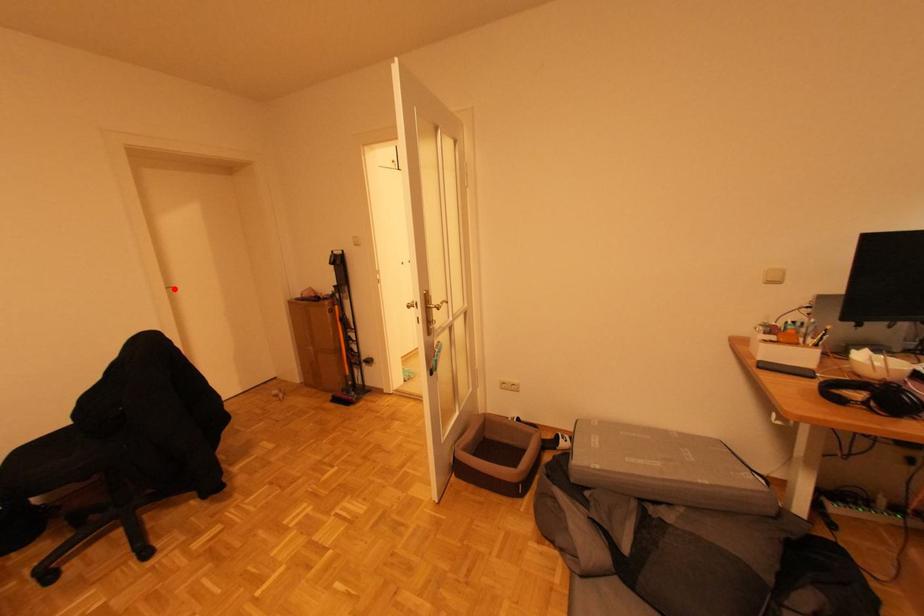
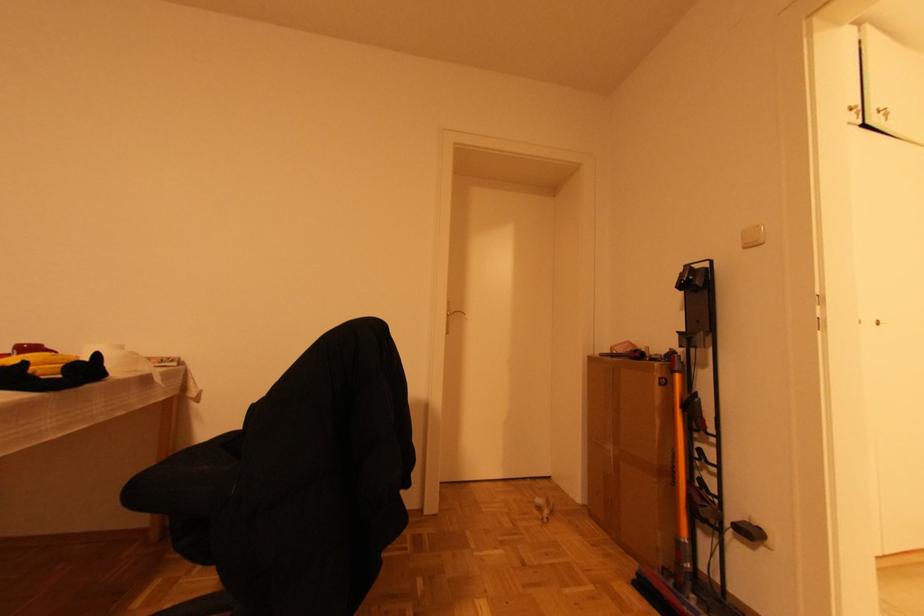
Find the pixel in the second image that matches the highlighted location in the first image.

(464, 313)